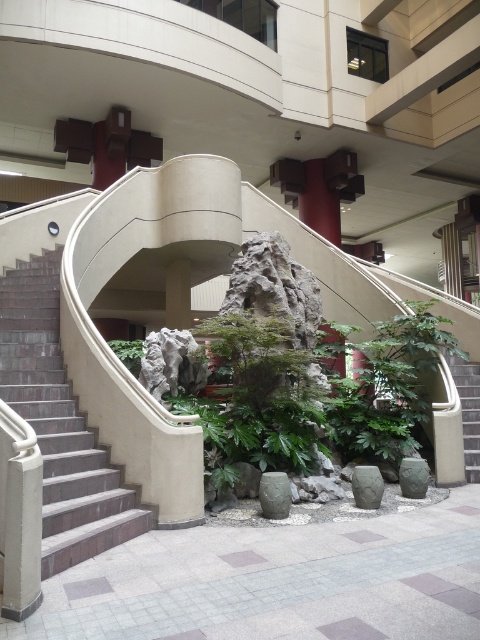
Question: Which point is farther to the camera?

Choices:
 (A) brick stairs at left
 (B) green leafy plant at center

Answer: (B)

Question: Which object appears farthest from the camera in this image?

Choices:
 (A) brick stairs at left
 (B) green leafy plant at center

Answer: (B)

Question: Does brick stairs at left have a greater width compared to green leafy plant at center?

Choices:
 (A) yes
 (B) no

Answer: (A)

Question: Which object appears farthest from the camera in this image?

Choices:
 (A) green leafy plant at center
 (B) brick stairs at left

Answer: (A)

Question: Does brick stairs at left have a smaller size compared to green leafy plant at center?

Choices:
 (A) yes
 (B) no

Answer: (B)

Question: Is brick stairs at left wider than green leafy plant at center?

Choices:
 (A) yes
 (B) no

Answer: (A)